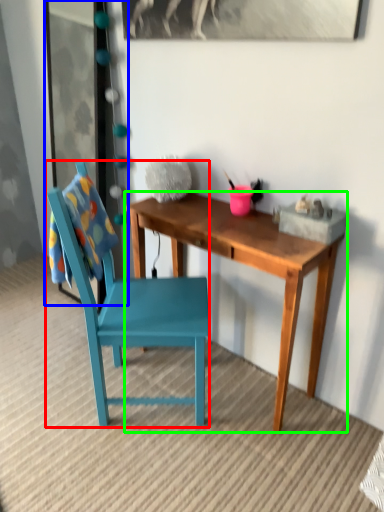
Question: Which object is the closest to the chair (highlighted by a red box)? Choose among these: glass door (highlighted by a blue box) or desk (highlighted by a green box).

Choices:
 (A) glass door
 (B) desk

Answer: (B)